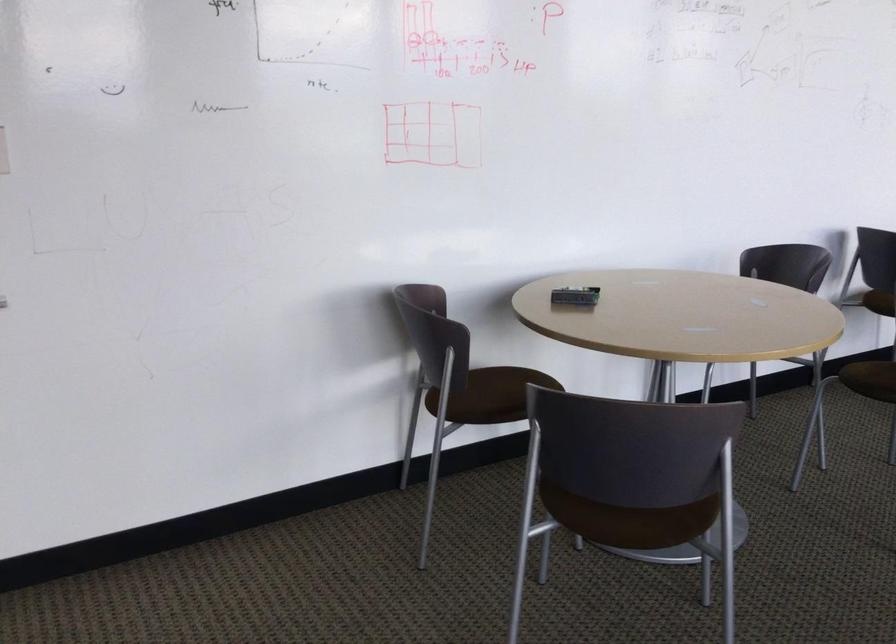
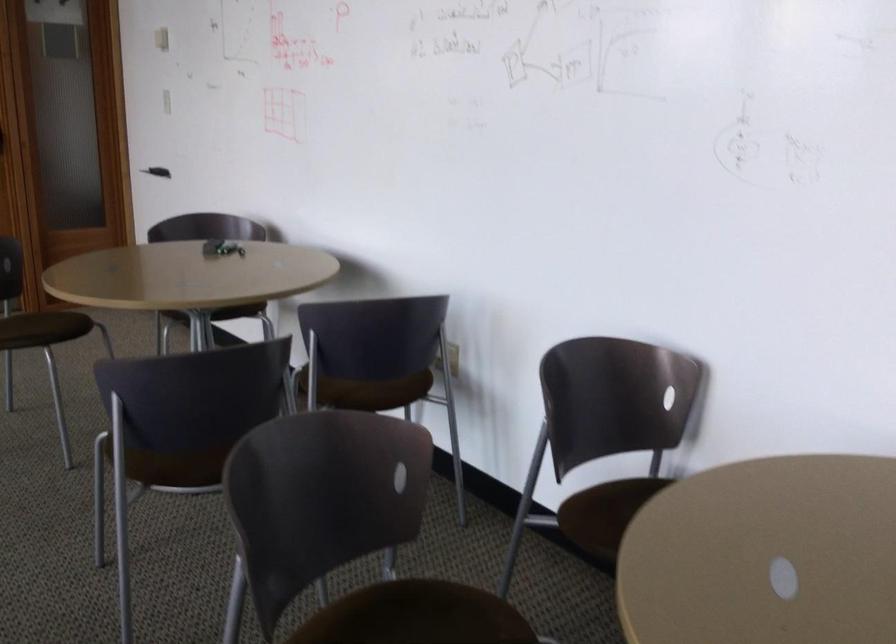
Question: I am providing you with two images of the same scene from different viewpoints. Which of the following objects are not visible in image2?

Choices:
 (A) set of keys
 (B) brown chair sitting surface
 (C) yellow square button
 (D) whiteboard eraser

Answer: (D)